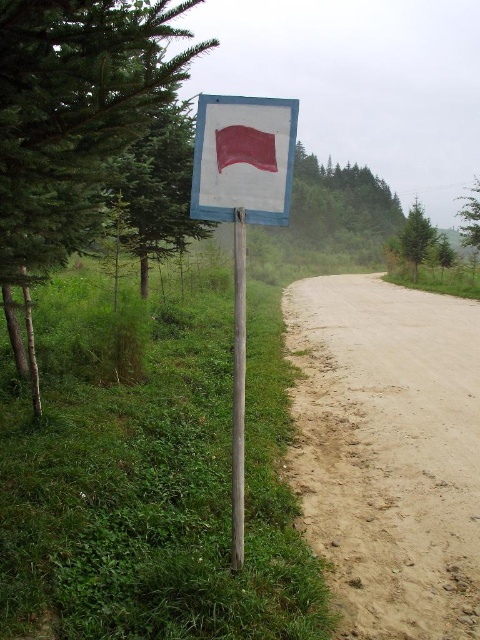
Is matte white flag at center bigger than blue painted wood pole at center?

Correct, matte white flag at center is larger in size than blue painted wood pole at center.

Image resolution: width=480 pixels, height=640 pixels. Find the location of `matte white flag at center`. matte white flag at center is located at coordinates coord(241,218).

You are a GUI agent. You are given a task and a screenshot of the screen. Output one action in this format:
    pyautogui.click(x=<x>, y=<y>)
    Task: Click on the matte white flag at center
    
    Given the screenshot: What is the action you would take?
    [x=241, y=218]

Can you confirm if brown sandy dirt track at right is thinner than green leafy tree at upper left?

In fact, brown sandy dirt track at right might be wider than green leafy tree at upper left.

Consider the image. Does brown sandy dirt track at right appear under green leafy tree at upper left?

Correct, brown sandy dirt track at right is located below green leafy tree at upper left.

The width and height of the screenshot is (480, 640). I want to click on brown sandy dirt track at right, so click(x=388, y=451).

Is blue painted wood pole at center shorter than green matte tree at right?

Correct, blue painted wood pole at center is not as tall as green matte tree at right.

Which is in front, point (236, 488) or point (405, 221)?

Point (236, 488) is in front.

Who is more forward, [238,344] or [415,220]?

Point [238,344] is more forward.

Where is `blue painted wood pole at center`? This screenshot has width=480, height=640. blue painted wood pole at center is located at coordinates click(239, 390).